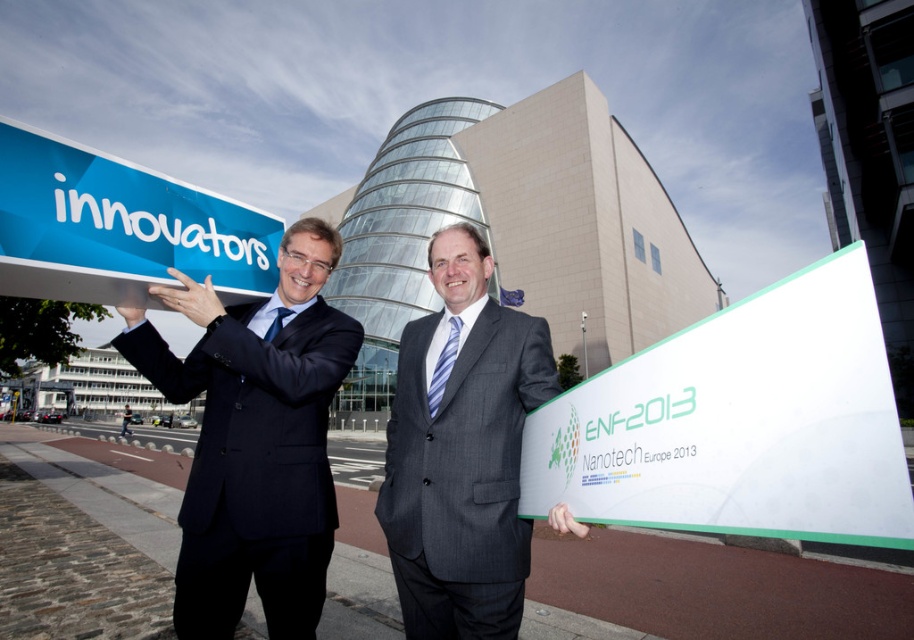
You are attending a job fair and see the white plastic sign at center and the gray suit at center. Which one is positioned to the right side?

The white plastic sign at center is to the right of the gray suit at center.

You are standing at the entrance of the building and want to hand out flyers to people passing by. You have two signs to place strategically. The white plastic sign at center and the blue plastic sign at upper left. Based on their positions, which sign is closer to the entrance?

The white plastic sign at center is 6.94 feet away from the blue plastic sign at upper left. Since the entrance is at the front of the building, the blue plastic sign at upper left is closer to the entrance compared to the white plastic sign at center which is further away.

You are attending a career fair and need to find the booth for Innovators. You see the dark blue suit at left and the blue plastic sign at upper left. Which direction should you move to locate the Innovators booth?

The dark blue suit at left is positioned under the blue plastic sign at upper left, so moving towards the blue plastic sign at upper left would lead you to the Innovators booth.